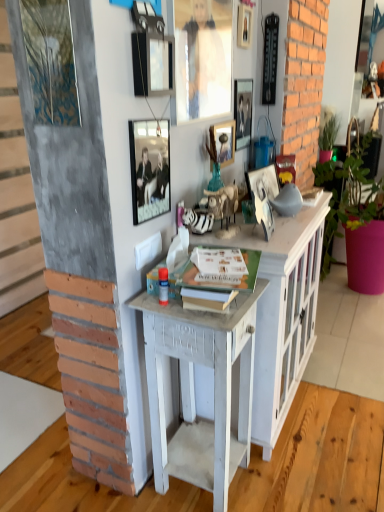
Question: From their relative heights in the image, would you say metallic silver picture frame at center, which is the 7th picture frame from left to right, is taller or shorter than matte glass picture frame at upper center, the 4th picture frame when ordered from right to left?

Choices:
 (A) short
 (B) tall

Answer: (A)

Question: Considering their positions, is metallic silver picture frame at center, acting as the 1th picture frame starting from the right, located in front of or behind matte glass picture frame at upper center, which is the fourth picture frame from left to right?

Choices:
 (A) behind
 (B) front

Answer: (B)

Question: Which object is positioned farthest from the pink matte pot at right?

Choices:
 (A) matte glass picture frame at upper center, acting as the fifth picture frame starting from the right
 (B) metallic silver picture frame at center, acting as the 1th picture frame starting from the right
 (C) white painted wood cabinet at center
 (D) metallic silver picture frame at upper center, placed as the first picture frame when sorted from left to right
 (E) metallic silver picture frame at upper center, marked as the second picture frame in a right-to-left arrangement

Answer: (D)

Question: Based on their relative distances, which object is nearer to the matte glass picture frame at upper center, which ranks as the third picture frame in left-to-right order?

Choices:
 (A) matte black picture frame at upper center, which ranks as the 6th picture frame in right-to-left order
 (B) metallic silver picture frame at upper center, which is counted as the 6th picture frame, starting from the left
 (C) metallic silver picture frame at upper center, the 7th picture frame when ordered from right to left
 (D) pink matte pot at right
 (E) metallic silver picture frame at center, acting as the 1th picture frame starting from the right

Answer: (A)